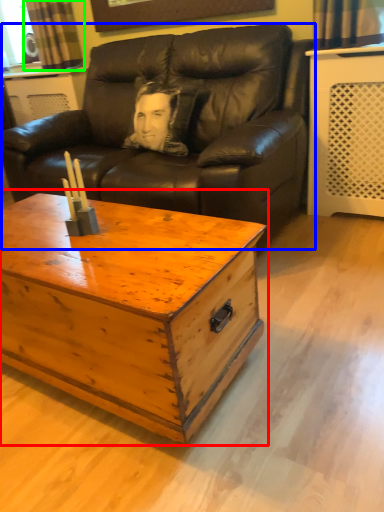
Question: Considering the real-world distances, which object is farthest from coffee table (highlighted by a red box)? studio couch (highlighted by a blue box) or curtain (highlighted by a green box)?

Choices:
 (A) studio couch
 (B) curtain

Answer: (B)